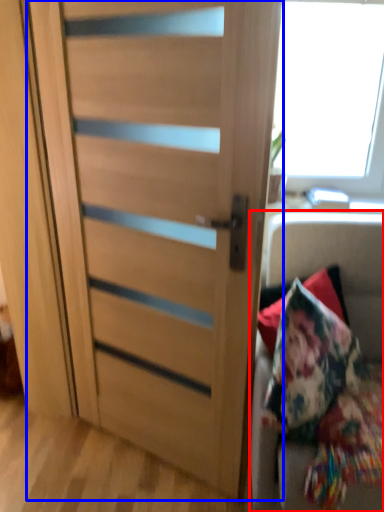
Question: Which of the following is the farthest to the observer, furniture (highlighted by a red box) or door (highlighted by a blue box)?

Choices:
 (A) furniture
 (B) door

Answer: (A)